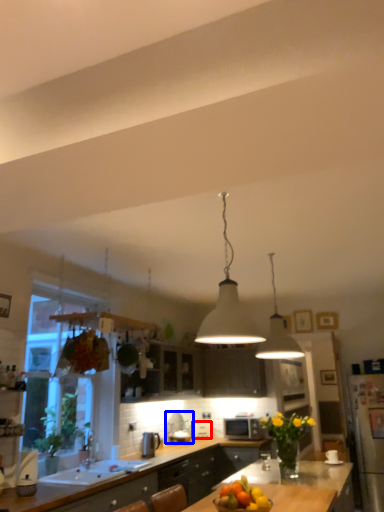
Question: Which object appears farthest to the camera in this image, appliance (highlighted by a red box) or appliance (highlighted by a blue box)?

Choices:
 (A) appliance
 (B) appliance

Answer: (A)